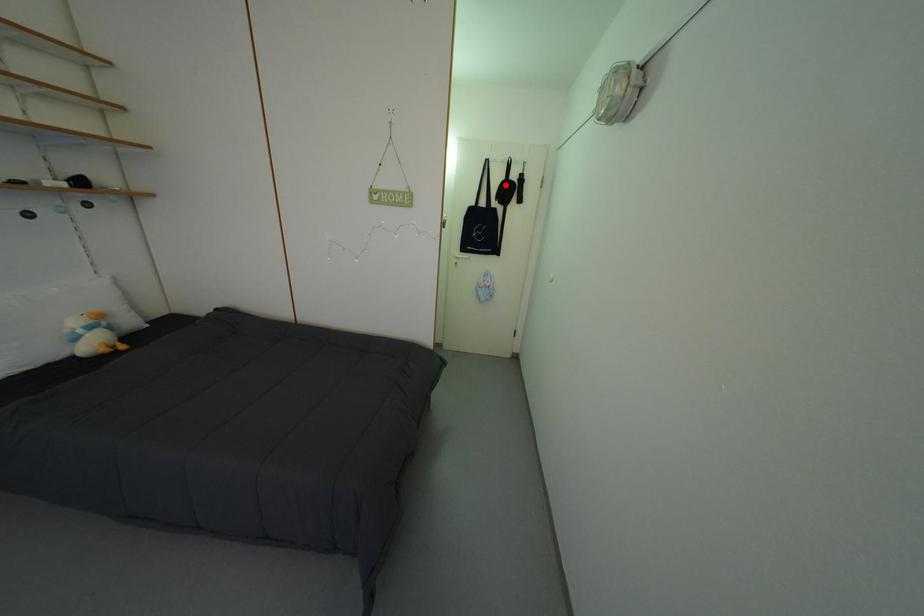
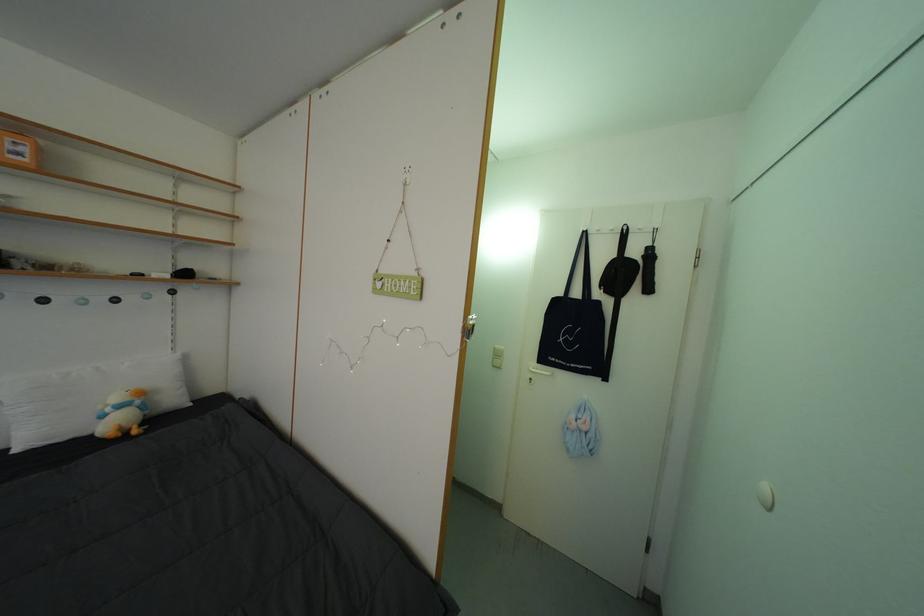
Question: I am providing you with two images of the same scene from different viewpoints. A red point is shown in image1. For the corresponding object point in image2, is it positioned nearer or farther from the camera?

Choices:
 (A) Nearer
 (B) Farther

Answer: (B)